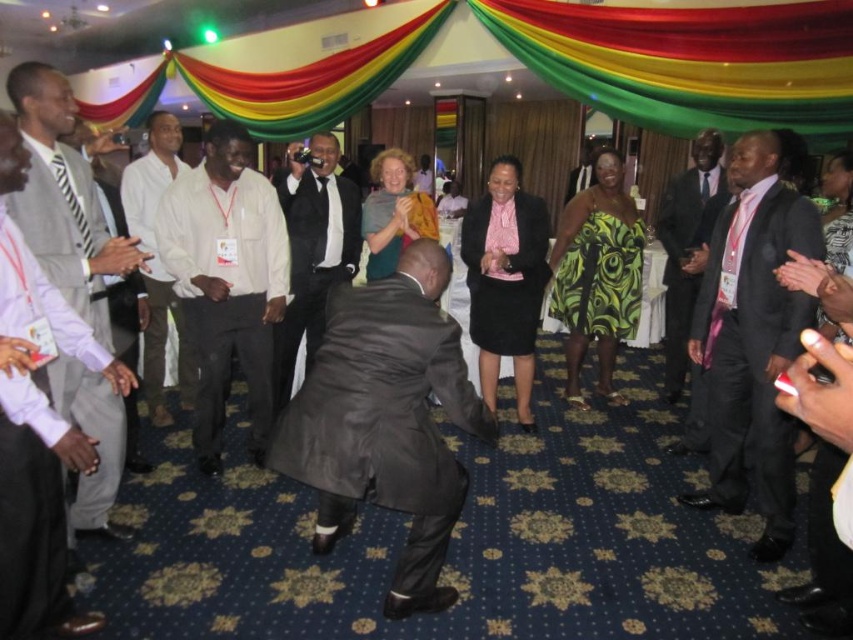
You are a photographer at the event and need to capture a photo of both the white cotton shirt at center and the pink satin dress at center in the same frame. Given that your camera has a focal length of 50mm and the minimum distance between subjects for clear focus is 6 feet, will you be able to take the photo without adjusting your position?

The distance between the white cotton shirt at center and the pink satin dress at center is 5.54 feet, which is less than the required 6 feet for clear focus. Therefore, you will need to adjust your position to increase the distance between them in the frame or use a different focal length to ensure both are in focus.